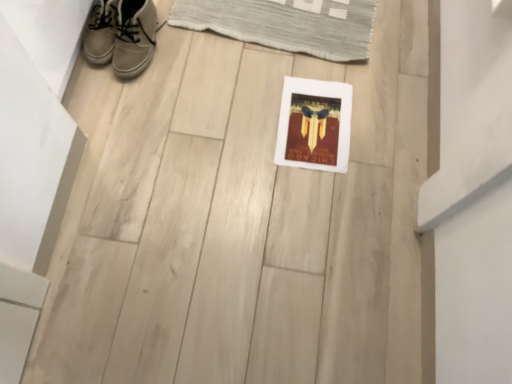
At what (x,y) coordinates should I click in order to perform the action: click on vacant space underneath white leather sneakers at upper left, which is the 2th footwear from left to right (from a real-world perspective). Please return your answer as a coordinate pair (x, y). The height and width of the screenshot is (384, 512). Looking at the image, I should click on (138, 56).